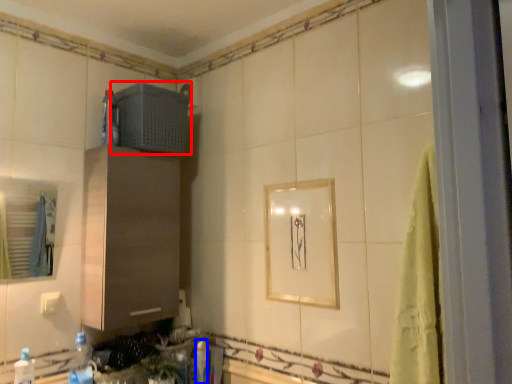
Question: Which point is closer to the camera, appliance (highlighted by a red box) or bottle (highlighted by a blue box)?

Choices:
 (A) appliance
 (B) bottle

Answer: (A)